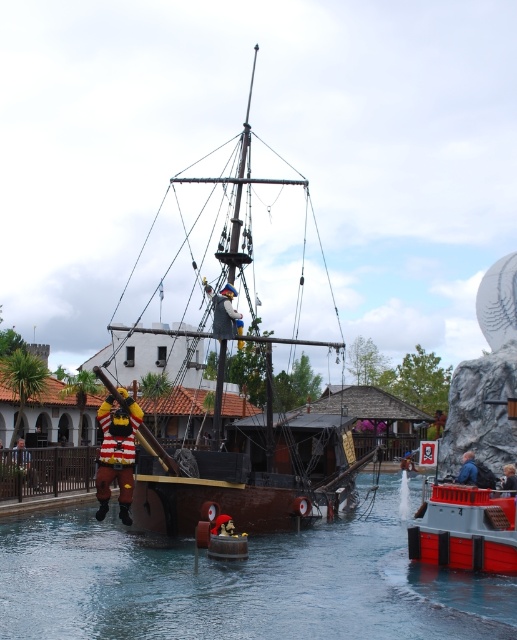
You are a visitor standing at the entrance of the pirate attraction. You see the brown wooden waterway at center and the wooden pirate ship at center. Which object is nearer to you?

The brown wooden waterway at center is closer to the viewer than the wooden pirate ship at center.

What are the coordinates of the brown wooden waterway at center?

The coordinates of the brown wooden waterway at center are at point (x=241, y=582).

You are a park visitor who wants to take a boat ride on the brown wooden waterway at center. The wooden pirate ship at center is blocking your path. Can you safely navigate around the ship to reach the waterway?

The brown wooden waterway at center is 16.71 meters away from the wooden pirate ship at center. Since the distance between them is significant, you can safely navigate around the ship to reach the waterway.